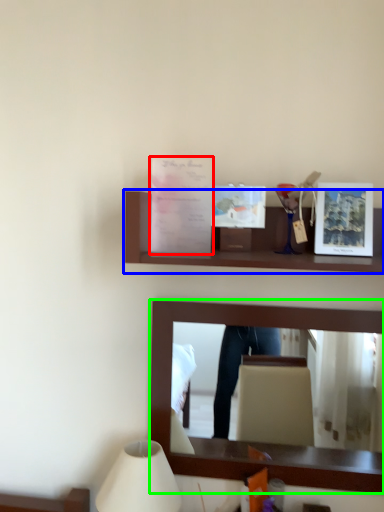
Question: Which object is the farthest from postcard (highlighted by a red box)? Choose among these: shelf (highlighted by a blue box) or mirror (highlighted by a green box).

Choices:
 (A) shelf
 (B) mirror

Answer: (B)